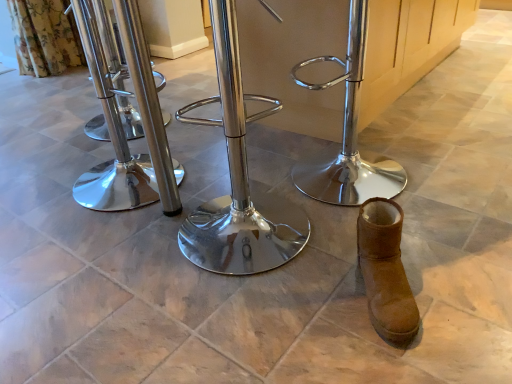
The image size is (512, 384). What are the coordinates of `vacant region in front of polished metal swivel chair at center, which is the second swivel chair from right to left` in the screenshot? It's located at (241, 322).